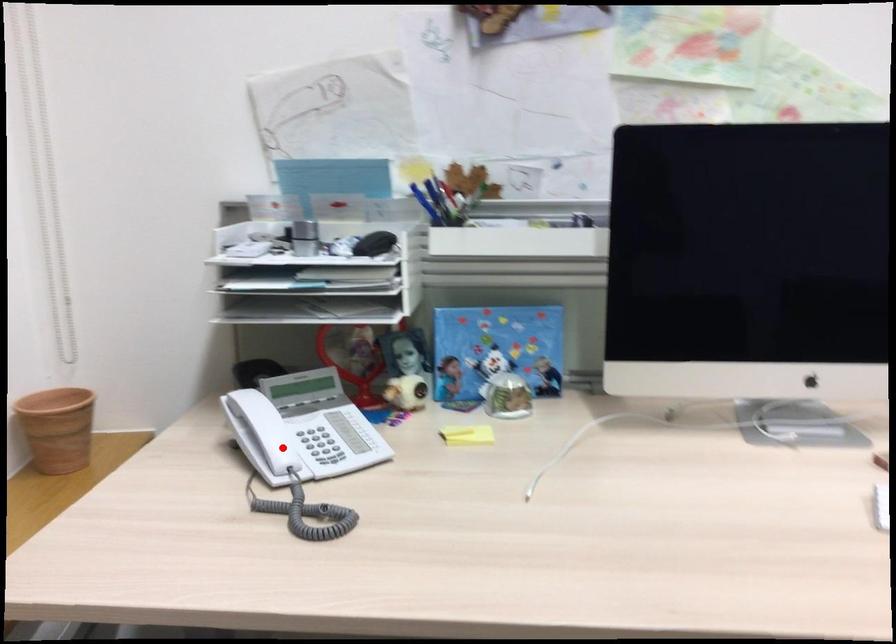
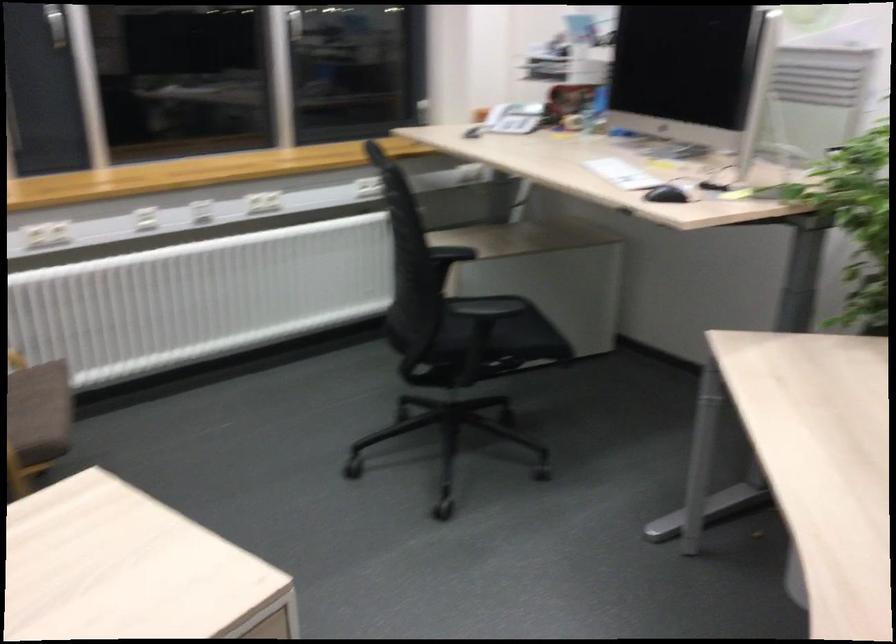
The point at the highlighted location is marked in the first image. Where is the corresponding point in the second image?

(496, 115)